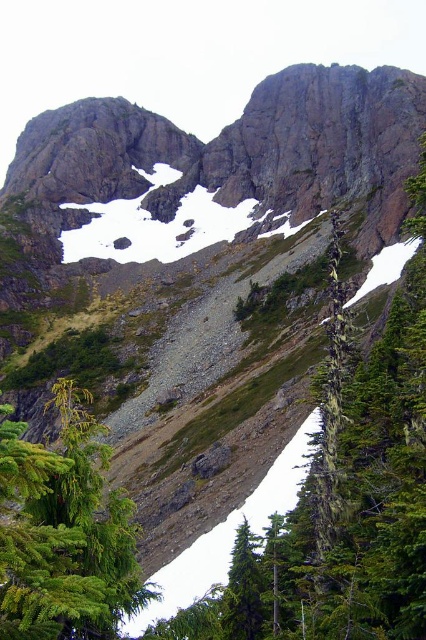
Question: Which point appears farthest from the camera in this image?

Choices:
 (A) (8, 572)
 (B) (236, 577)

Answer: (B)

Question: Where is green matte evergreen tree at lower left located in relation to green matte tree at lower center in the image?

Choices:
 (A) right
 (B) left

Answer: (B)

Question: Which of the following is the farthest from the observer?

Choices:
 (A) white powder snow at upper center
 (B) green matte tree at lower center
 (C) green matte evergreen tree at lower left

Answer: (A)

Question: Can you confirm if green matte evergreen tree at lower left is thinner than white powder snow at upper center?

Choices:
 (A) yes
 (B) no

Answer: (A)

Question: Does green matte evergreen tree at lower left appear under white powder snow at upper center?

Choices:
 (A) yes
 (B) no

Answer: (A)

Question: Estimate the real-world distances between objects in this image. Which object is closer to the white powder snow at upper center?

Choices:
 (A) green matte tree at lower center
 (B) green matte evergreen tree at lower left

Answer: (B)